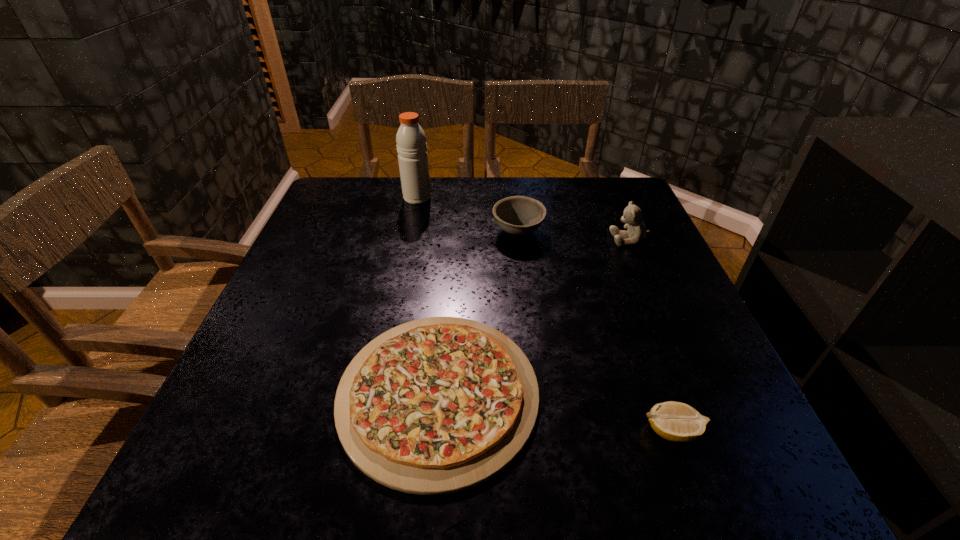
I want to click on vacant space at the far edge of the desktop, so click(x=508, y=180).

Image resolution: width=960 pixels, height=540 pixels. What are the coordinates of `vacant area at the left edge` in the screenshot? It's located at (312, 289).

Identify the location of vacant space at the right edge of the desktop. pos(678,313).

Identify the location of vacant position at the far left corner of the desktop. (327, 213).

The image size is (960, 540). I want to click on free location at the far right corner, so pyautogui.click(x=583, y=180).

This screenshot has width=960, height=540. I want to click on free space between the fourth tallest object and the bowl, so click(595, 332).

I want to click on empty space between the pizza and the second shortest object, so click(555, 412).

Identify the location of free space between the shaker and the bowl. (468, 214).

Identify the location of empty space that is in between the teddy bear and the second shortest object. (651, 335).

The height and width of the screenshot is (540, 960). In order to click on free space that is in between the lemon and the second tallest object in this screenshot , I will do `click(651, 335)`.